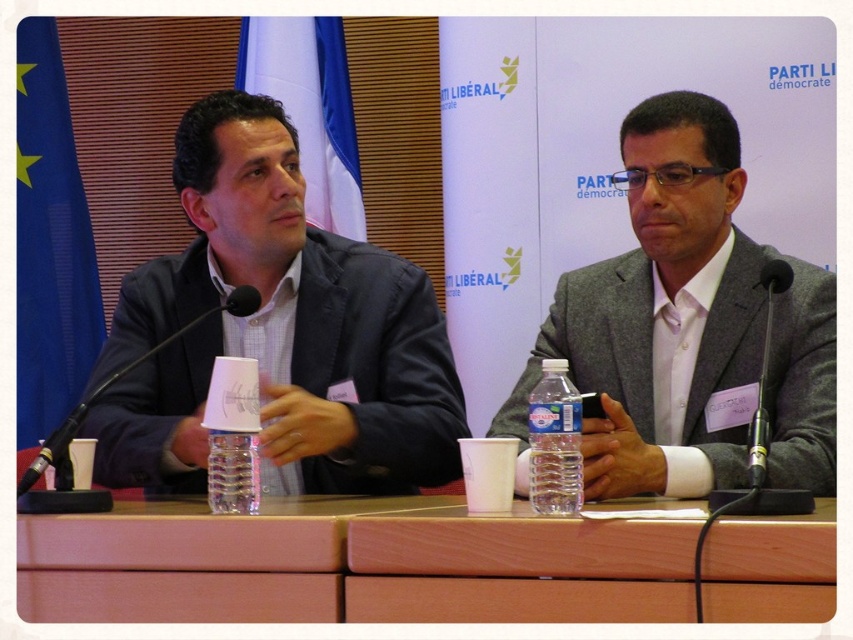
Question: Is the position of gray wool suit at center less distant than that of clear plastic water bottle at center?

Choices:
 (A) yes
 (B) no

Answer: (B)

Question: In this image, where is clear plastic water bottle at center located relative to black matte microphone at left?

Choices:
 (A) above
 (B) below

Answer: (B)

Question: Which point is farther from the camera taking this photo?

Choices:
 (A) (564, 483)
 (B) (140, 593)
 (C) (288, 307)
 (D) (254, 296)

Answer: (C)

Question: Which of the following is the closest to the observer?

Choices:
 (A) (618, 326)
 (B) (19, 496)
 (C) (209, 128)
 (D) (299, 582)

Answer: (D)

Question: Is wooden table at center thinner than black matte microphone at left?

Choices:
 (A) no
 (B) yes

Answer: (A)

Question: Which point is closer to the camera taking this photo?

Choices:
 (A) (326, 454)
 (B) (73, 429)
 (C) (570, 454)
 (D) (639, 353)

Answer: (C)